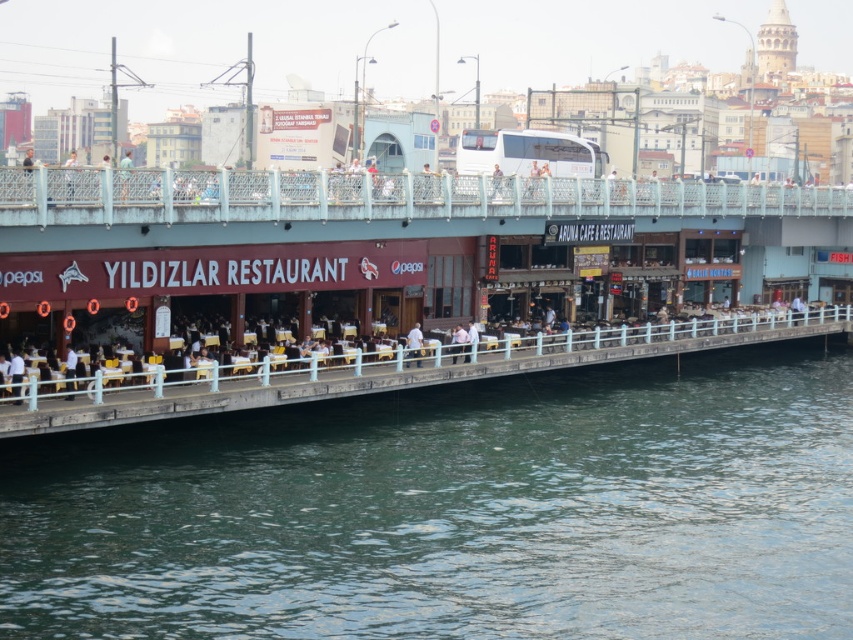
Question: From the image, what is the correct spatial relationship of white painted wood dock at lower center in relation to white plastic chair at upper center?

Choices:
 (A) right
 (B) left

Answer: (A)

Question: Estimate the real-world distances between objects in this image. Which object is farther from the light blue fabric shirt at upper left?

Choices:
 (A) matte black jacket at upper left
 (B) white fabric shirt at lower left
 (C) greenish-blue water at lower center
 (D) white painted wood dock at lower center

Answer: (B)

Question: Does white painted wood dock at lower center have a greater width compared to white plastic chair at upper center?

Choices:
 (A) yes
 (B) no

Answer: (B)

Question: Which object is the closest to the light blue fabric shirt at upper left?

Choices:
 (A) white fabric shirt at center
 (B) white painted wood dock at lower center

Answer: (B)

Question: Estimate the real-world distances between objects in this image. Which object is farther from the matte black jacket at upper left?

Choices:
 (A) brown wooden restaurant at center
 (B) light blue fabric shirt at upper left
 (C) white painted wood dock at lower center
 (D) metallic bridge at upper center

Answer: (D)

Question: Does metallic bridge at upper center appear under white painted wood dock at lower center?

Choices:
 (A) yes
 (B) no

Answer: (B)